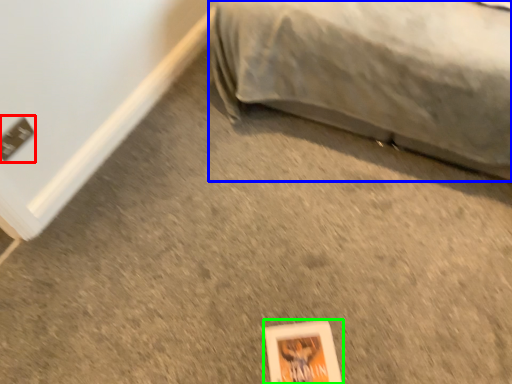
Question: Which object is positioned closest to electric outlet (highlighted by a red box)? Select from furniture (highlighted by a blue box) and paperback book (highlighted by a green box).

Choices:
 (A) furniture
 (B) paperback book

Answer: (B)